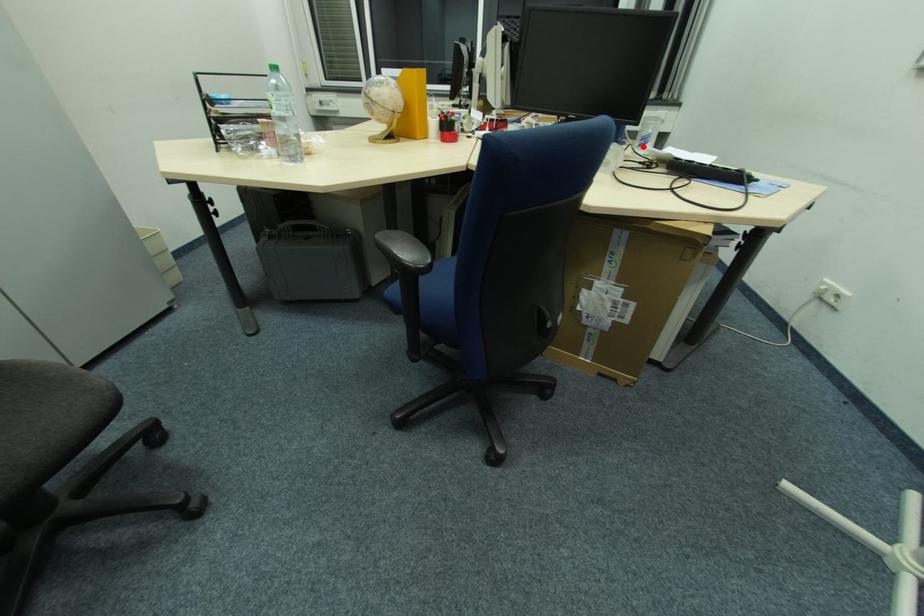
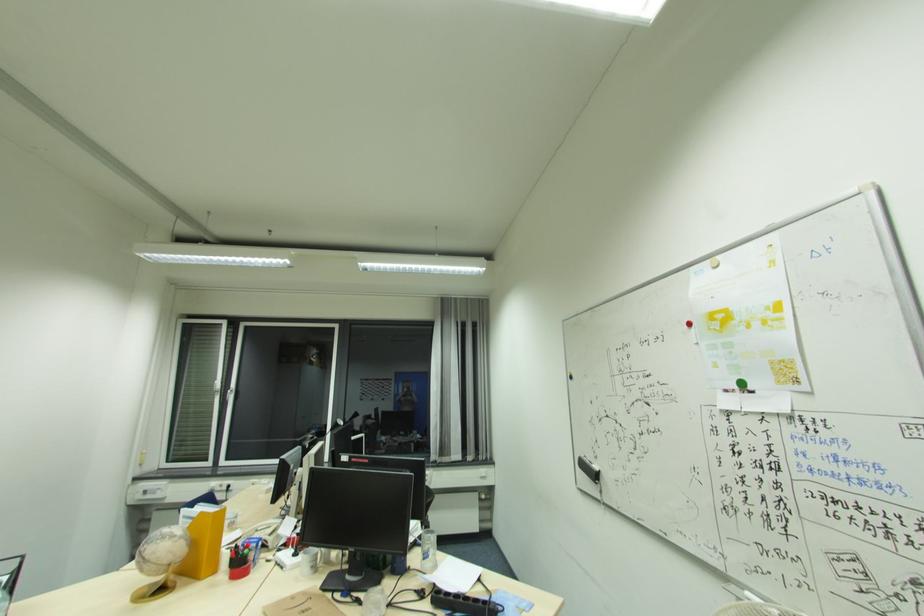
In the second image, find the point that corresponds to the highlighted location in the first image.

(428, 560)